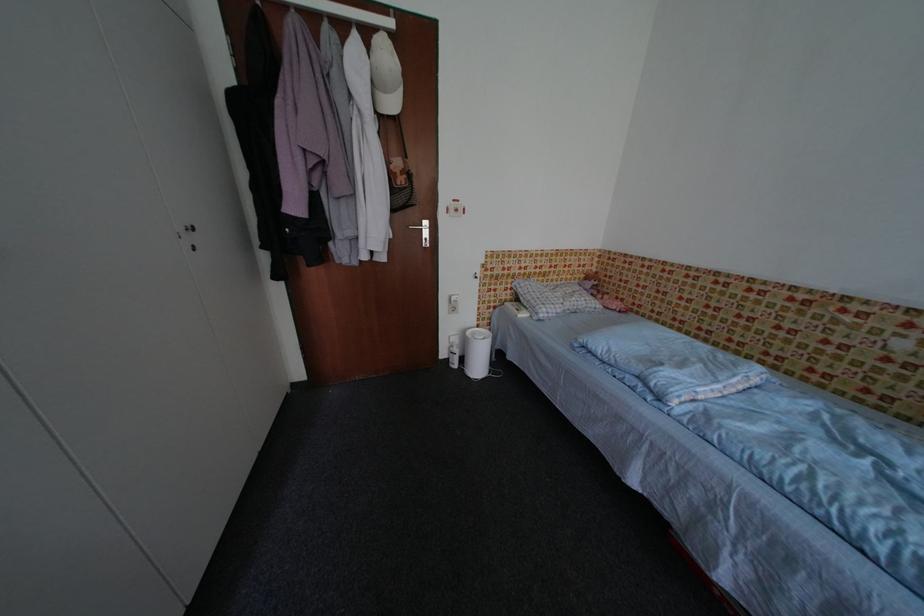
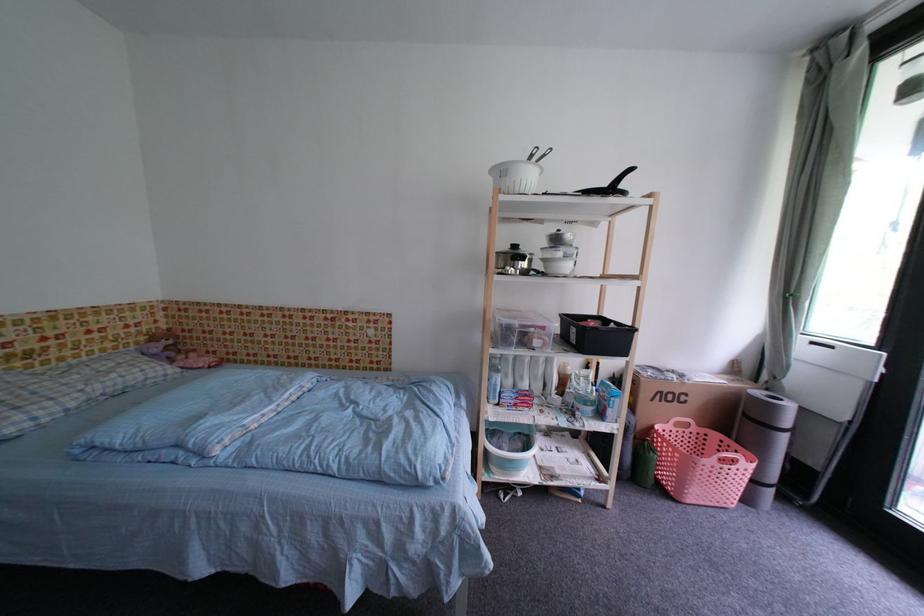
Question: Based on the continuous images, in which direction is the camera rotating? Reply with the corresponding letter.

Choices:
 (A) Left
 (B) Right
 (C) Up
 (D) Down

Answer: (B)